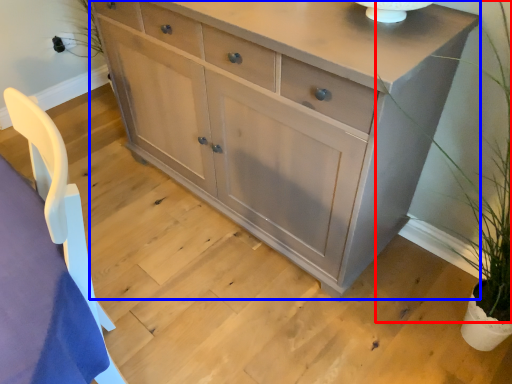
Question: Which object appears closest to the camera in this image, plant (highlighted by a red box) or chest of drawers (highlighted by a blue box)?

Choices:
 (A) plant
 (B) chest of drawers

Answer: (A)